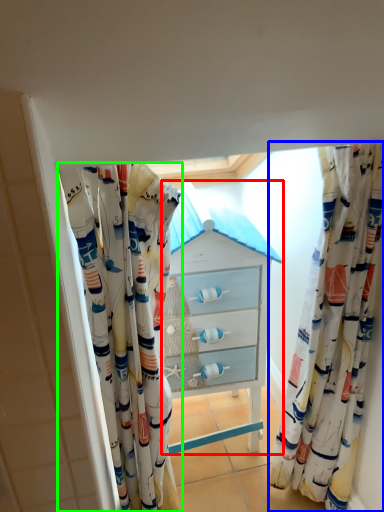
Question: Which object is positioned closest to chest of drawers (highlighted by a red box)? Select from curtain (highlighted by a blue box) and curtain (highlighted by a green box).

Choices:
 (A) curtain
 (B) curtain

Answer: (B)